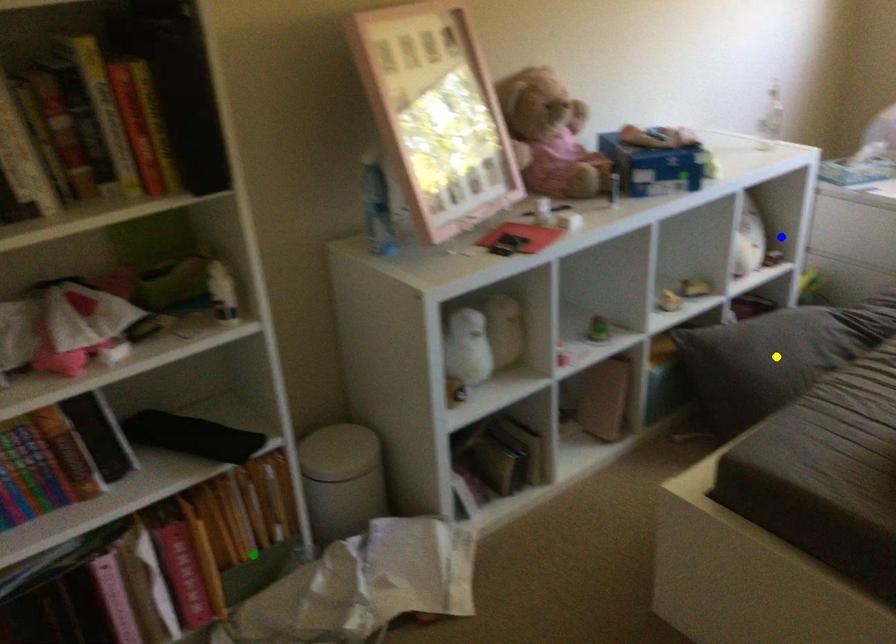
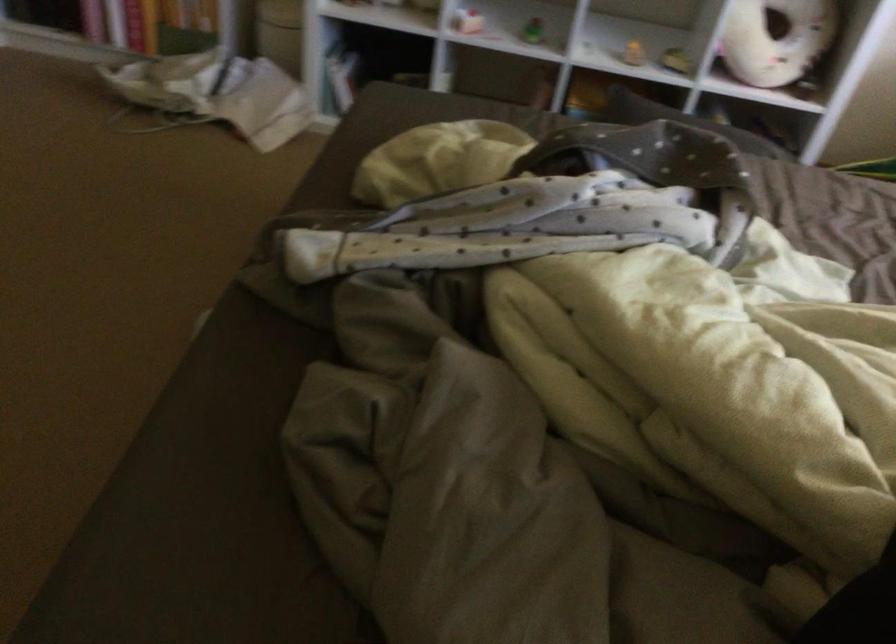
I am providing you with two images of the same scene from different viewpoints. Three points are marked in image1. Which point corresponds to a part or object that is occluded in image2?In image1, three points are marked. Which of them correspond to a part or object that is occluded in image2?Among the three points shown in image1, which one corresponds to a part or object that is no longer visible due to occlusion in image2?

yellow point